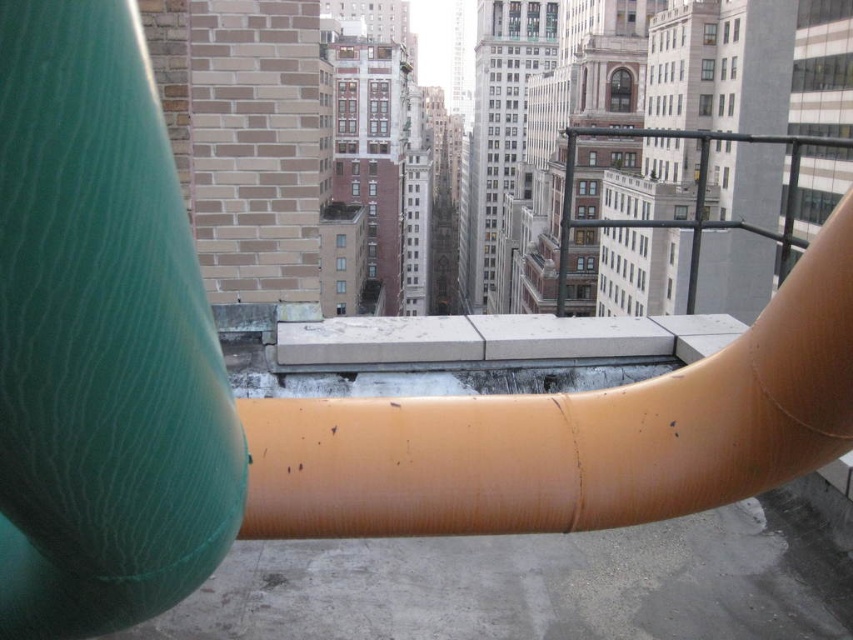
Is orange rubber pipe at center wider than black metal rail at upper right?

No.

Identify the location of orange rubber pipe at center. This screenshot has height=640, width=853. (572, 435).

Describe the element at coordinates (100, 339) in the screenshot. The width and height of the screenshot is (853, 640). I see `green rubber water pipe at left` at that location.

Who is lower down, green rubber water pipe at left or black metal rail at upper right?

green rubber water pipe at left

Does point (7, 173) come behind point (567, 168)?

No.

Where is `green rubber water pipe at left`? green rubber water pipe at left is located at coordinates (100, 339).

Can you confirm if green rubber water pipe at left is bigger than orange rubber pipe at center?

No.

Between green rubber water pipe at left and orange rubber pipe at center, which one has less height?

With less height is orange rubber pipe at center.

Is point (144, 292) in front of point (456, 508)?

Yes, point (144, 292) is closer to viewer.

The image size is (853, 640). In order to click on green rubber water pipe at left in this screenshot , I will do `click(100, 339)`.